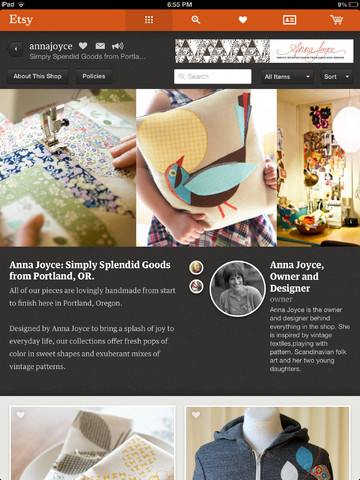
Locate an element on the screen. mannequin is located at coordinates (261, 426).